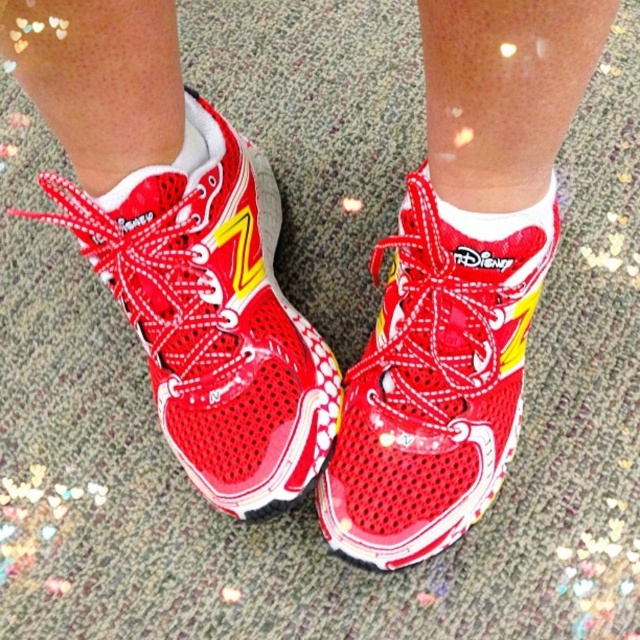
Can you confirm if shiny red running shoe at center is positioned above shiny red shoe at center?

Yes, shiny red running shoe at center is above shiny red shoe at center.

Based on the photo, can you confirm if shiny red running shoe at center is taller than shiny red shoe at center?

Yes.

Who is more distant from viewer, (164, 269) or (433, 444)?

The point (433, 444) is more distant.

Image resolution: width=640 pixels, height=640 pixels. What are the coordinates of `shiny red running shoe at center` in the screenshot? It's located at (212, 316).

Who is shorter, shiny red running shoe at center or white soft sock at center?

white soft sock at center is shorter.

Is shiny red running shoe at center to the left of white soft sock at center from the viewer's perspective?

Correct, you'll find shiny red running shoe at center to the left of white soft sock at center.

Locate an element on the screen. The height and width of the screenshot is (640, 640). shiny red running shoe at center is located at coordinates [x=212, y=316].

In order to click on shiny red running shoe at center in this screenshot , I will do `click(212, 316)`.

Is point (122, 266) positioned behind point (140, 172)?

That is True.

Who is lower down, shiny red running shoe at center or white fabric sock at center?

shiny red running shoe at center is below.

Which is in front, point (234, 458) or point (122, 189)?

Point (122, 189) is in front.

Find the location of a particular element. The width and height of the screenshot is (640, 640). shiny red running shoe at center is located at coordinates (212, 316).